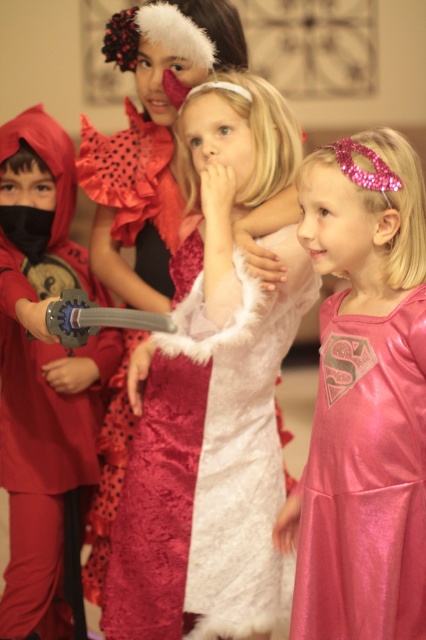
You are standing at the origin point in the room. There are two points marked in the scene. The first point is at coordinate point[48,172] and the second is at point[158,173]. Which point is closer to you?

Point[158,173] is closer to you because it is in front of point[48,172].

You are a photographer setting up for a group photo. You see the matte red ninja suit at left and the pink shiny dress at right in the frame. Which costume is positioned higher in the image?

The matte red ninja suit at left is above the pink shiny dress at right in the image.